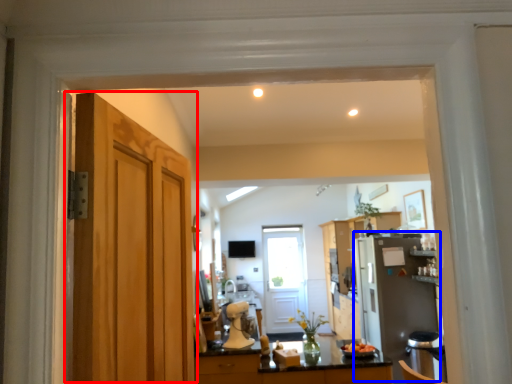
Question: Which of the following is the farthest to the observer, door (highlighted by a red box) or appliance (highlighted by a blue box)?

Choices:
 (A) door
 (B) appliance

Answer: (B)